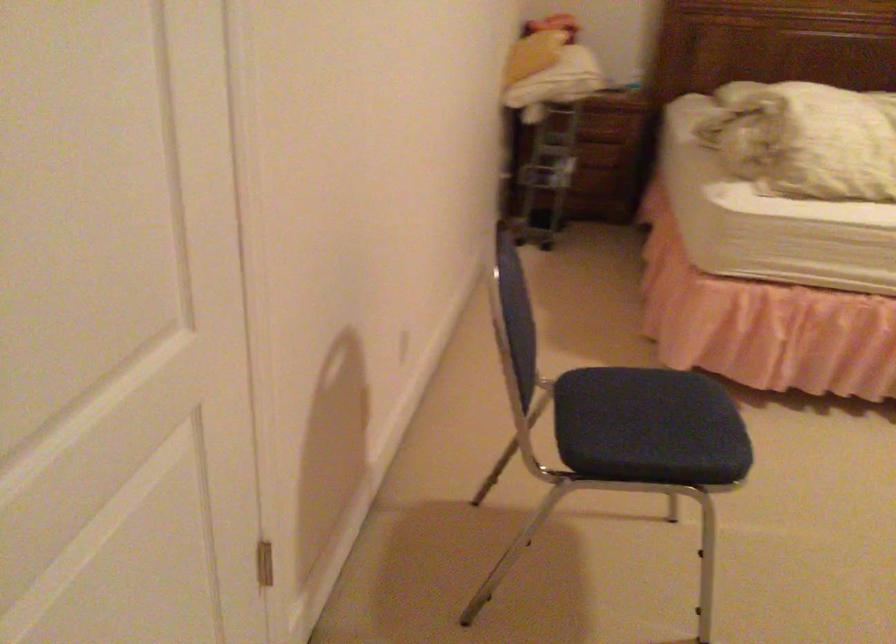
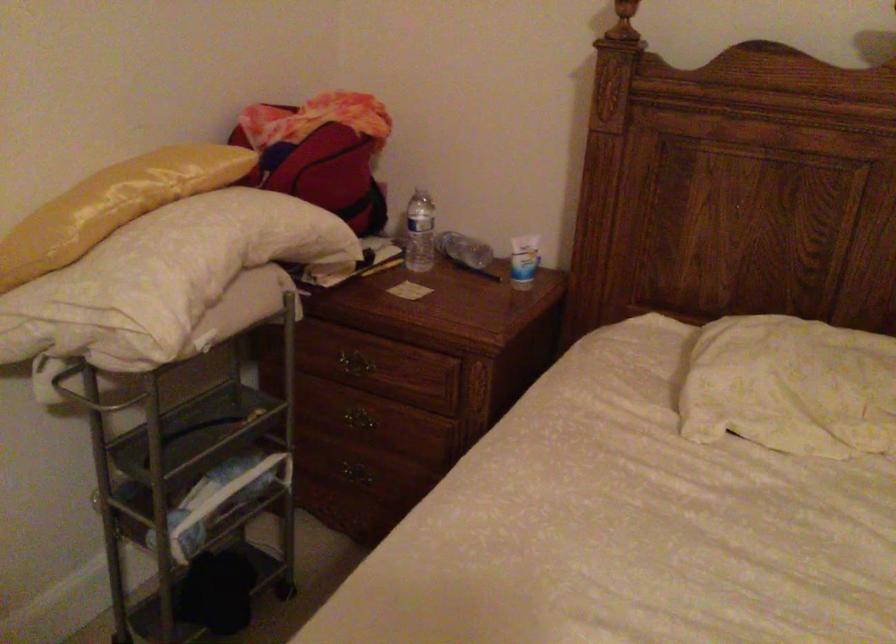
In the second image, find the point that corresponds to point (557, 93) in the first image.

(91, 393)